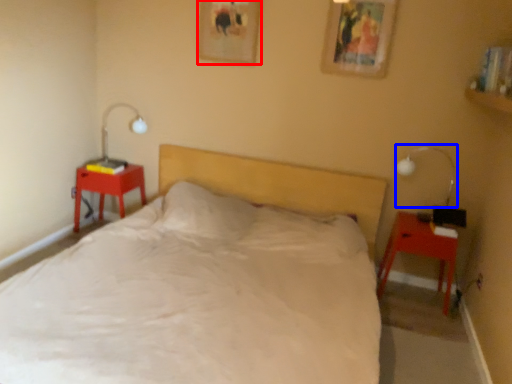
Question: Which object appears closest to the camera in this image, picture frame (highlighted by a red box) or bedside lamp (highlighted by a blue box)?

Choices:
 (A) picture frame
 (B) bedside lamp

Answer: (B)